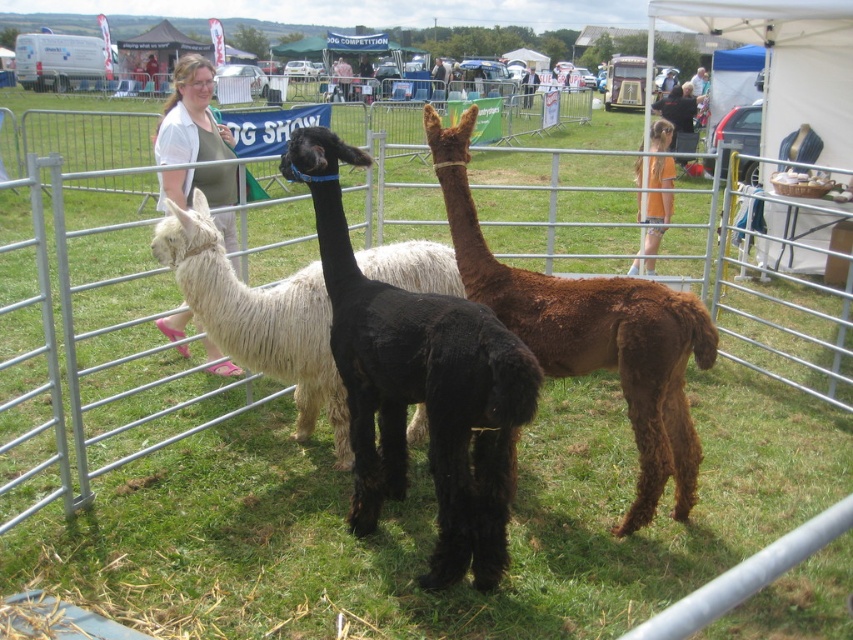
Question: Does black fuzzy alpaca at center appear on the right side of matte white shirt at center?

Choices:
 (A) no
 (B) yes

Answer: (B)

Question: Is white fluffy alpaca at left further to the viewer compared to matte white shirt at center?

Choices:
 (A) yes
 (B) no

Answer: (B)

Question: Among these points, which one is nearest to the camera?

Choices:
 (A) (471, 104)
 (B) (288, 364)
 (C) (668, 172)
 (D) (170, 163)

Answer: (B)

Question: Which object appears farthest from the camera in this image?

Choices:
 (A) orange cotton shirt at upper right
 (B) white fluffy alpaca at left
 (C) black fuzzy alpaca at center

Answer: (A)

Question: Estimate the real-world distances between objects in this image. Which object is farther from the brown fuzzy alpaca at center?

Choices:
 (A) black fuzzy alpaca at center
 (B) white fluffy alpaca at left
 (C) matte white shirt at center

Answer: (C)

Question: Observing the image, what is the correct spatial positioning of white fluffy alpaca at left in reference to orange cotton shirt at upper right?

Choices:
 (A) above
 (B) below

Answer: (B)